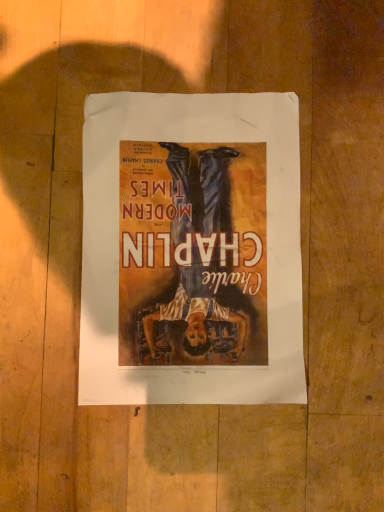
You are a GUI agent. You are given a task and a screenshot of the screen. Output one action in this format:
    pyautogui.click(x=<x>, y=<y>)
    Task: Click on the vacant space situated above matte paper poster at center (from a real-world perspective)
    
    Given the screenshot: What is the action you would take?
    pyautogui.click(x=197, y=261)